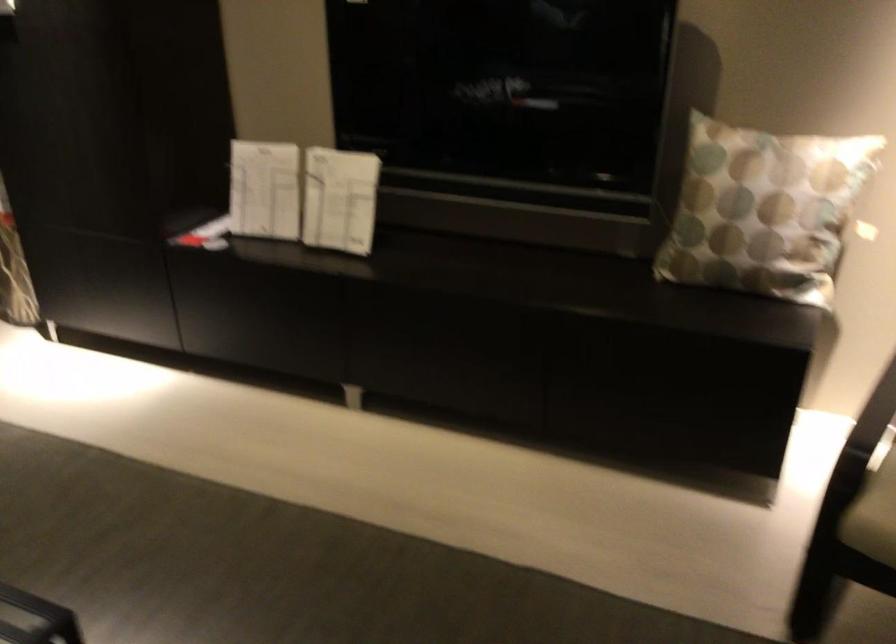
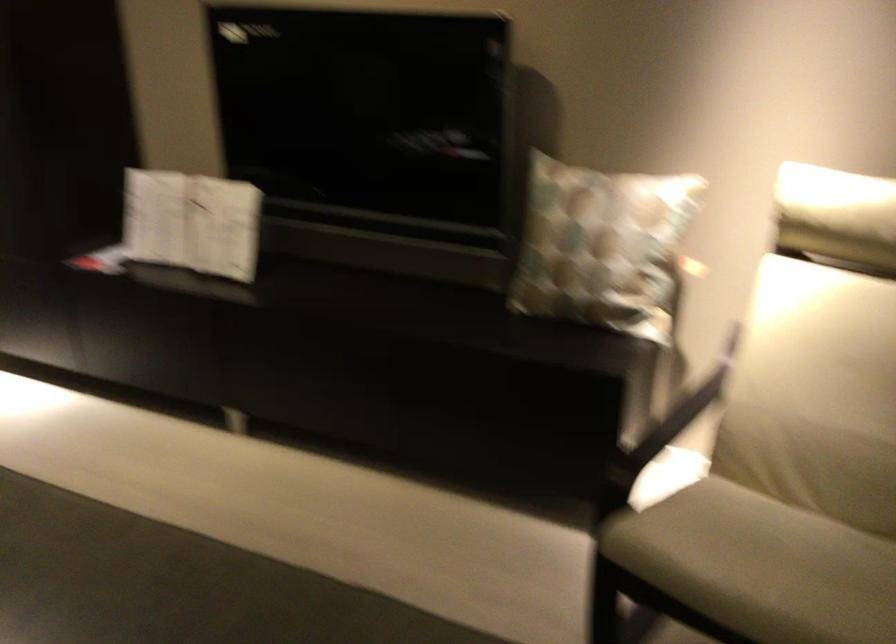
In the second image, find the point that corresponds to point (771, 209) in the first image.

(602, 245)